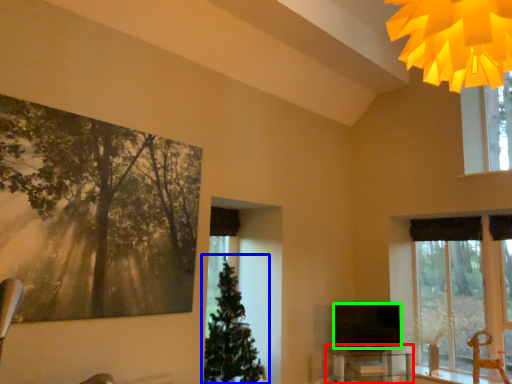
Question: Which is nearer to the table (highlighted by a red box)? christmas tree (highlighted by a blue box) or television (highlighted by a green box).

Choices:
 (A) christmas tree
 (B) television

Answer: (B)